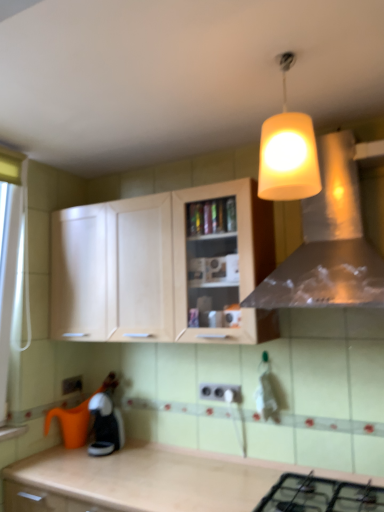
Question: From a real-world perspective, is light wood cabinet at center on white plastic electric outlet at center, which is the first electric outlet in front-to-back order?

Choices:
 (A) no
 (B) yes

Answer: (B)

Question: Is white plastic electric outlet at center, which is the 2th electric outlet from left to right, at the back of light wood cabinet at center?

Choices:
 (A) no
 (B) yes

Answer: (A)

Question: Is light wood cabinet at center not close to white plastic electric outlet at center, which appears as the second electric outlet when viewed from the back?

Choices:
 (A) yes
 (B) no

Answer: (B)

Question: From a real-world perspective, is light wood cabinet at center physically below white plastic electric outlet at center, which is counted as the first electric outlet, starting from the right?

Choices:
 (A) no
 (B) yes

Answer: (A)

Question: Can you confirm if light wood cabinet at center is bigger than white plastic electric outlet at center, which appears as the second electric outlet when viewed from the back?

Choices:
 (A) yes
 (B) no

Answer: (A)

Question: From the image's perspective, is light wood cabinet at center positioned above or below metallic silver vent at upper center?

Choices:
 (A) above
 (B) below

Answer: (B)

Question: From a real-world perspective, is light wood cabinet at center positioned above or below metallic silver vent at upper center?

Choices:
 (A) above
 (B) below

Answer: (B)

Question: In terms of size, does light wood cabinet at center appear bigger or smaller than metallic silver vent at upper center?

Choices:
 (A) big
 (B) small

Answer: (A)

Question: Is point (220, 258) closer or farther from the camera than point (329, 214)?

Choices:
 (A) farther
 (B) closer

Answer: (A)

Question: Considering the positions of white plastic electric outlet at center, which is the first electric outlet in front-to-back order, and light wood cabinet at center in the image, is white plastic electric outlet at center, which is the first electric outlet in front-to-back order, taller or shorter than light wood cabinet at center?

Choices:
 (A) tall
 (B) short

Answer: (B)

Question: From a real-world perspective, is white plastic electric outlet at center, which is counted as the first electric outlet, starting from the right, positioned above or below light wood cabinet at center?

Choices:
 (A) below
 (B) above

Answer: (A)

Question: Is white plastic electric outlet at center, which is the 2th electric outlet from left to right, spatially inside light wood cabinet at center, or outside of it?

Choices:
 (A) outside
 (B) inside

Answer: (A)

Question: Does point (218, 384) appear closer or farther from the camera than point (269, 337)?

Choices:
 (A) farther
 (B) closer

Answer: (A)

Question: From a real-world perspective, is black matte gas stove at lower center physically located above or below yellow matte lampshade at upper center?

Choices:
 (A) below
 (B) above

Answer: (A)

Question: Is black matte gas stove at lower center taller or shorter than yellow matte lampshade at upper center?

Choices:
 (A) tall
 (B) short

Answer: (B)